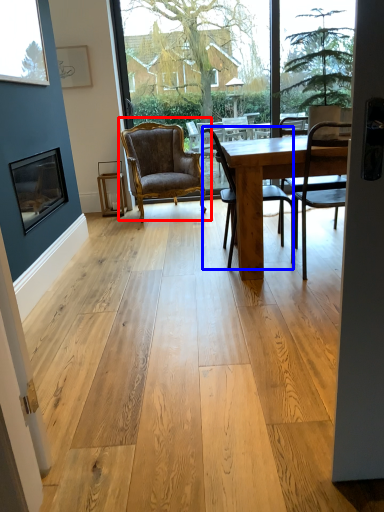
Question: Which object appears farthest to the camera in this image, chair (highlighted by a red box) or chair (highlighted by a blue box)?

Choices:
 (A) chair
 (B) chair

Answer: (A)